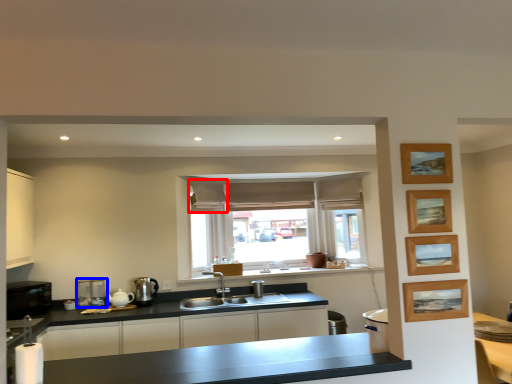
Question: Which object is closer to the camera taking this photo, curtain (highlighted by a red box) or coffee machine (highlighted by a blue box)?

Choices:
 (A) curtain
 (B) coffee machine

Answer: (B)